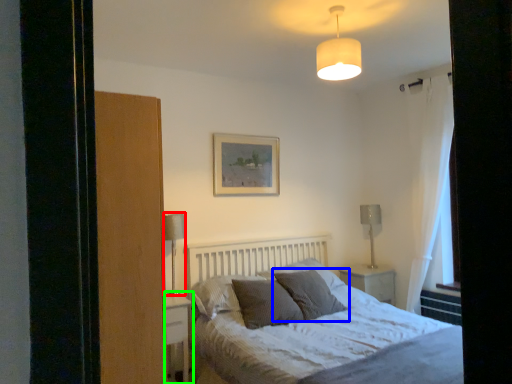
Question: Which is nearer to the table lamp (highlighted by a red box)? pillow (highlighted by a blue box) or nightstand (highlighted by a green box).

Choices:
 (A) pillow
 (B) nightstand

Answer: (B)